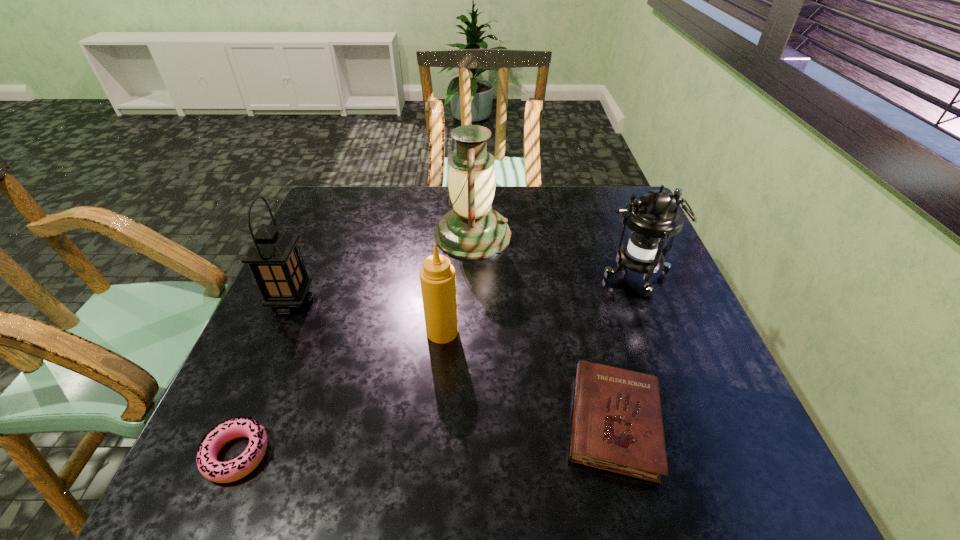
Locate an element on the screen. unoccupied position between the condiment and the rightmost lantern is located at coordinates (539, 304).

The width and height of the screenshot is (960, 540). I want to click on vacant area that lies between the third nearest object and the hardback book, so click(x=528, y=377).

The height and width of the screenshot is (540, 960). In order to click on blank region between the rightmost lantern and the hardback book in this screenshot , I will do `click(624, 350)`.

Where is `vacant space in between the leftmost lantern and the fourth farthest object`? vacant space in between the leftmost lantern and the fourth farthest object is located at coordinates (368, 317).

In order to click on free space that is in between the rightmost lantern and the condiment in this screenshot , I will do `click(539, 304)`.

At what (x,y) coordinates should I click in order to perform the action: click on object that is the closest to the second lantern from right to left. Please return your answer as a coordinate pair (x, y). Looking at the image, I should click on (652, 218).

Locate an element on the screen. object that ranks as the fifth closest to the doughnut is located at coordinates (652, 218).

The width and height of the screenshot is (960, 540). What are the coordinates of `lantern that can be found as the closest to the hardback book` in the screenshot? It's located at (652, 218).

Where is `lantern that is the closest one to the hardback book`? lantern that is the closest one to the hardback book is located at coordinates [x=652, y=218].

I want to click on free space that satisfies the following two spatial constraints: 1. on the front side of the hardback book; 2. on the left side of the fourth farthest object, so [435, 423].